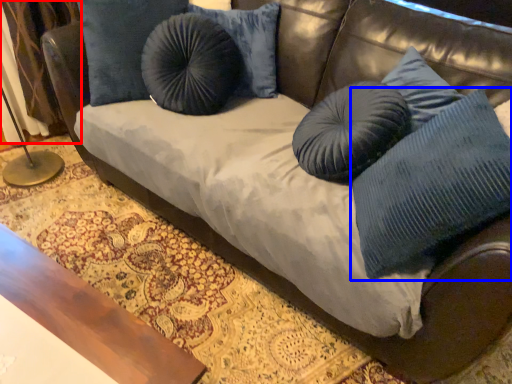
Question: Which object is further to the camera taking this photo, curtain (highlighted by a red box) or pillow (highlighted by a blue box)?

Choices:
 (A) curtain
 (B) pillow

Answer: (A)